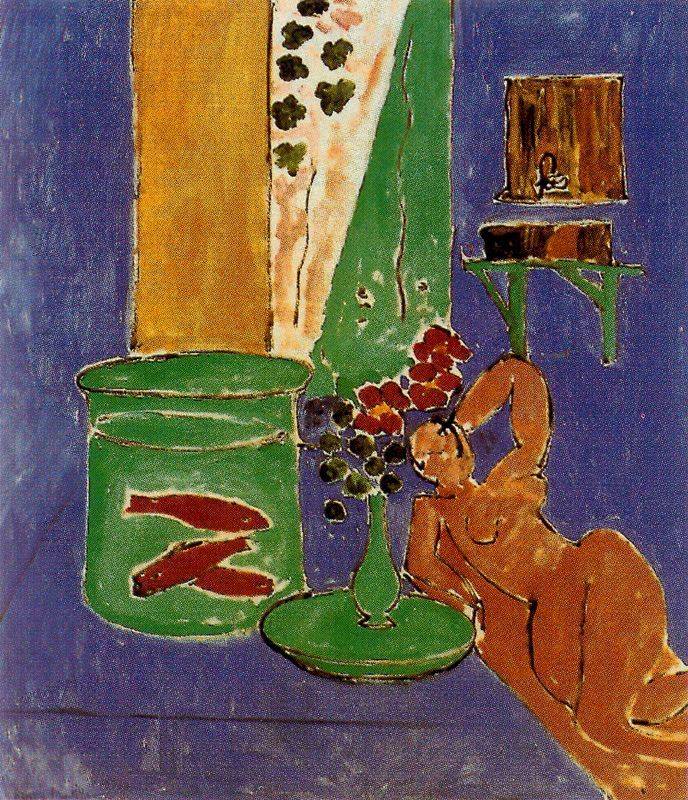
At what (x,y) coordinates should I click in order to perform the action: click on green round plate. Please return your answer as a coordinate pair (x, y). Image resolution: width=688 pixels, height=800 pixels. Looking at the image, I should click on pos(440,664).